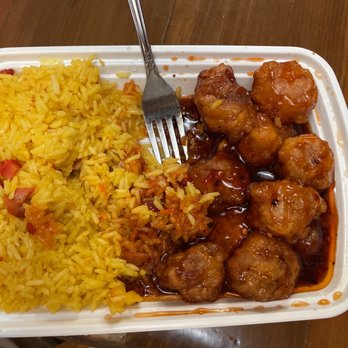
You are a GUI agent. You are given a task and a screenshot of the screen. Output one action in this format:
    pyautogui.click(x=<x>, y=<y>)
    Task: Click on the table top below the serving tray
    
    Given the screenshot: What is the action you would take?
    pyautogui.click(x=262, y=333)